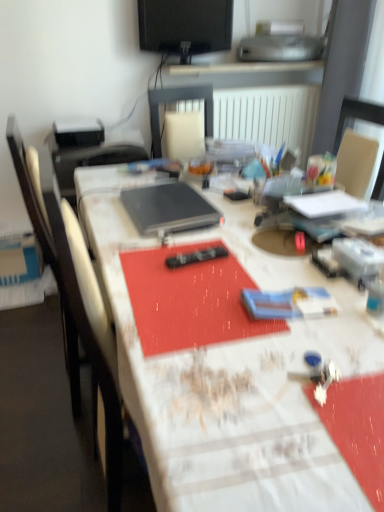
This screenshot has height=512, width=384. Find the location of `vacant region above white textured table at center (from a real-world perspective)`. vacant region above white textured table at center (from a real-world perspective) is located at coordinates (x=235, y=248).